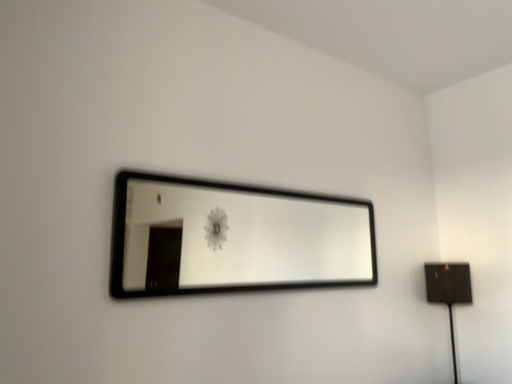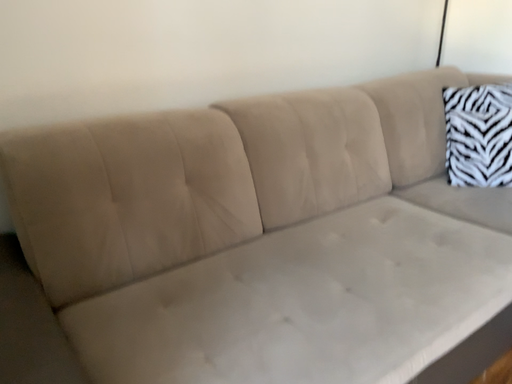
Question: Which way did the camera rotate in the video?

Choices:
 (A) rotated upward
 (B) rotated downward

Answer: (B)